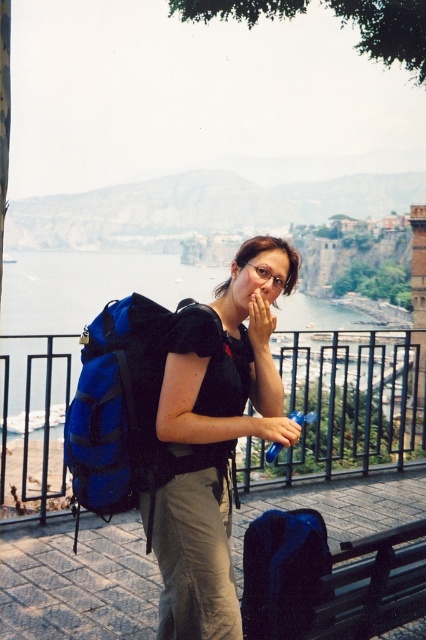
Question: Which object appears farthest from the camera in this image?

Choices:
 (A) blue fabric water at center
 (B) blue fabric backpack at center

Answer: (A)

Question: Is black matte backpack at center bigger than metal/rusty rail at left?

Choices:
 (A) yes
 (B) no

Answer: (B)

Question: Does metal/rusty rail at left have a greater width compared to blue fabric backpack at center?

Choices:
 (A) yes
 (B) no

Answer: (A)

Question: Can you confirm if blue fabric water at center is bigger than matte black hand at center?

Choices:
 (A) yes
 (B) no

Answer: (A)

Question: Which of these objects is positioned closest to the metal/rusty rail at left?

Choices:
 (A) black matte backpack at center
 (B) blue fabric backpack at center
 (C) matte black hand at center

Answer: (B)

Question: Which object is farther from the camera taking this photo?

Choices:
 (A) blue fabric backpack at center
 (B) matte black hand at center
 (C) blue fabric water at center

Answer: (C)